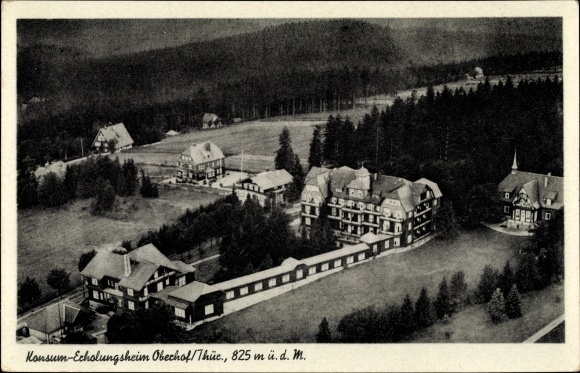
Where is `chimney`? The width and height of the screenshot is (580, 373). chimney is located at coordinates (206, 145).